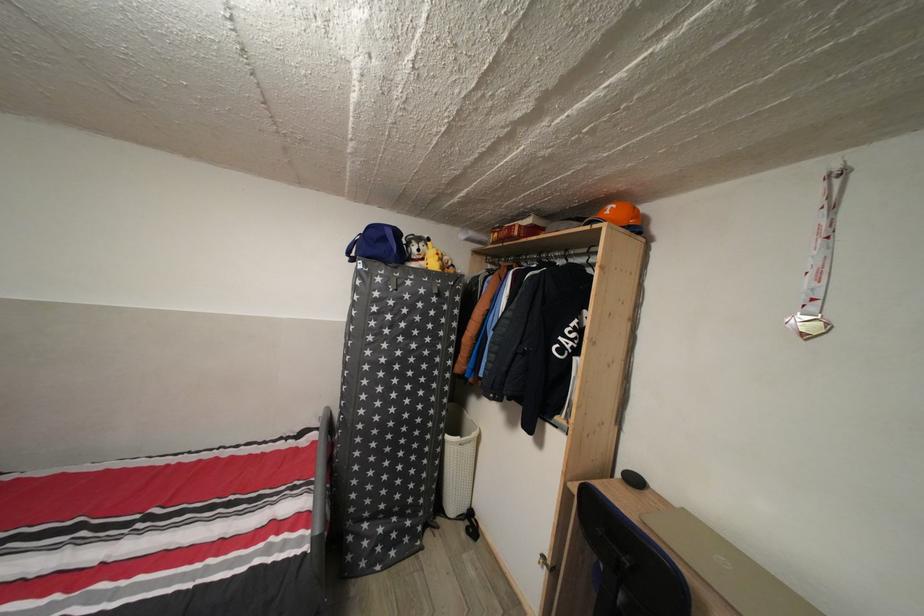
The width and height of the screenshot is (924, 616). Find the location of `white laundry basket`. white laundry basket is located at coordinates (457, 461).